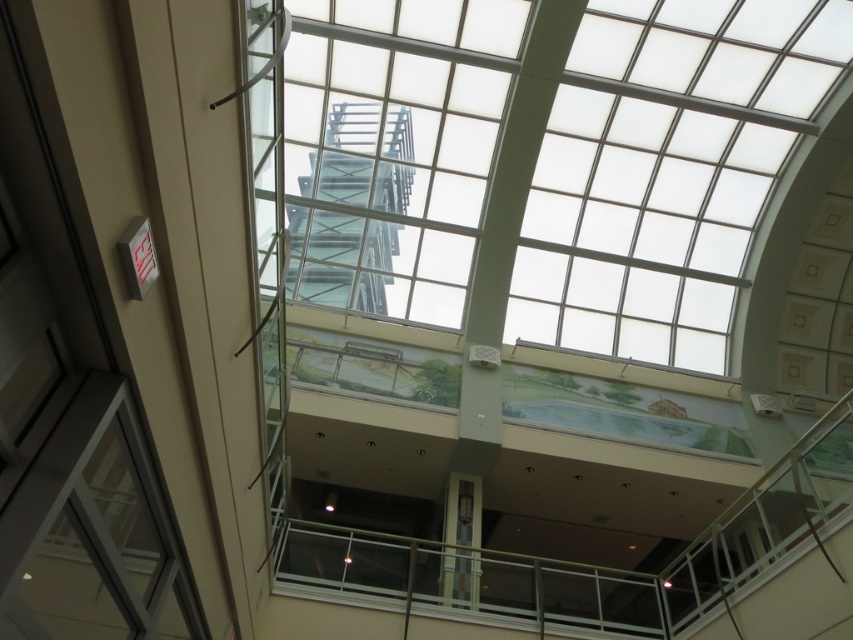
Is the position of clear glass window at lower left more distant than that of clear glass staircase at center?

No.

Where is `clear glass window at lower left`? This screenshot has width=853, height=640. clear glass window at lower left is located at coordinates (91, 532).